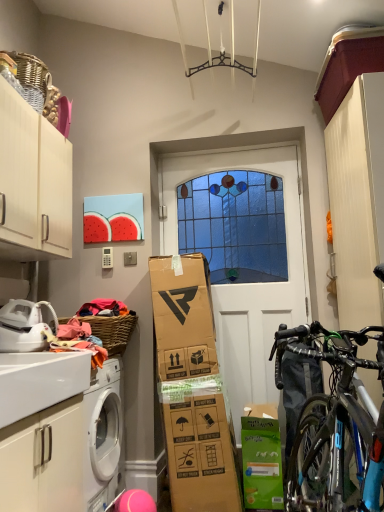
Question: From a real-world perspective, is shiny black bicycle at right below white matte cabinet at upper left, the first cabinetry when ordered from top to bottom?

Choices:
 (A) yes
 (B) no

Answer: (A)

Question: Would you say shiny black bicycle at right contains white matte cabinet at upper left, marked as the second cabinetry in a bottom-to-top arrangement?

Choices:
 (A) yes
 (B) no

Answer: (B)

Question: Can you confirm if shiny black bicycle at right is wider than white matte cabinet at upper left, the first cabinetry when ordered from top to bottom?

Choices:
 (A) yes
 (B) no

Answer: (B)

Question: Considering the relative positions of shiny black bicycle at right and white matte cabinet at upper left, the first cabinetry when ordered from top to bottom, in the image provided, is shiny black bicycle at right behind white matte cabinet at upper left, the first cabinetry when ordered from top to bottom,?

Choices:
 (A) yes
 (B) no

Answer: (A)

Question: Is shiny black bicycle at right positioned beyond the bounds of white matte cabinet at upper left, the first cabinetry when ordered from top to bottom?

Choices:
 (A) yes
 (B) no

Answer: (A)

Question: Are shiny black bicycle at right and white matte cabinet at upper left, the first cabinetry when ordered from top to bottom, making contact?

Choices:
 (A) no
 (B) yes

Answer: (A)

Question: Can you confirm if white matte cabinet at upper left, the first cabinetry when ordered from top to bottom, is shorter than shiny black bicycle at right?

Choices:
 (A) yes
 (B) no

Answer: (A)

Question: From a real-world perspective, is white matte cabinet at upper left, the first cabinetry when ordered from top to bottom, below shiny black bicycle at right?

Choices:
 (A) yes
 (B) no

Answer: (B)

Question: Is white matte cabinet at upper left, the first cabinetry when ordered from top to bottom, facing towards shiny black bicycle at right?

Choices:
 (A) yes
 (B) no

Answer: (B)

Question: Does white matte cabinet at upper left, marked as the second cabinetry in a bottom-to-top arrangement, touch shiny black bicycle at right?

Choices:
 (A) no
 (B) yes

Answer: (A)

Question: Can you confirm if white matte cabinet at upper left, marked as the second cabinetry in a bottom-to-top arrangement, is wider than shiny black bicycle at right?

Choices:
 (A) yes
 (B) no

Answer: (A)

Question: From the image's perspective, is white matte cabinet at upper left, the first cabinetry when ordered from top to bottom, located beneath shiny black bicycle at right?

Choices:
 (A) yes
 (B) no

Answer: (B)

Question: Considering the relative positions of woven brown basket at upper left and white matte door at center in the image provided, is woven brown basket at upper left to the right of white matte door at center from the viewer's perspective?

Choices:
 (A) no
 (B) yes

Answer: (A)